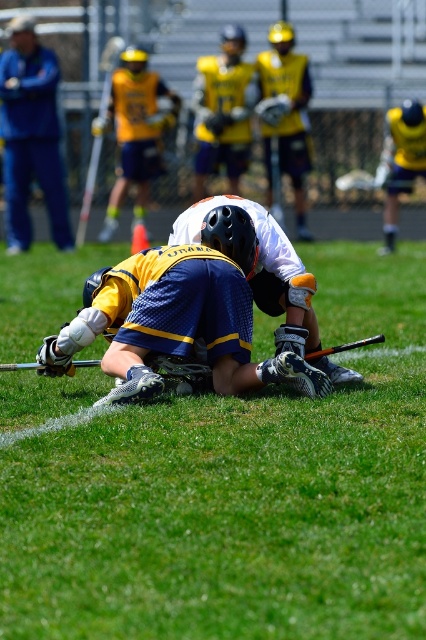
Does point (86, 184) lie in front of point (11, 364)?

No, it is not.

Between point (97, 145) and point (94, 365), which one is positioned in front?

Positioned in front is point (94, 365).

Does point (112, 68) lie in front of point (20, 365)?

No, (112, 68) is behind (20, 365).

I want to click on matte white hockey stick at upper left, so click(x=98, y=131).

Who is more distant from viewer, (347,273) or (164,301)?

Point (347,273)

The height and width of the screenshot is (640, 426). What do you see at coordinates (238, 496) in the screenshot?
I see `blue fabric jersey at center` at bounding box center [238, 496].

This screenshot has width=426, height=640. I want to click on blue fabric jersey at center, so click(238, 496).

Who is positioned more to the left, blue mesh jersey at center or blue fabric jacket at upper left?

blue fabric jacket at upper left is more to the left.

Is blue mesh jersey at center below blue fabric jacket at upper left?

Indeed, blue mesh jersey at center is positioned under blue fabric jacket at upper left.

Is point (164, 256) positioned behind point (43, 113)?

No, (164, 256) is in front of (43, 113).

Image resolution: width=426 pixels, height=640 pixels. What are the coordinates of `blue mesh jersey at center` in the screenshot? It's located at (181, 316).